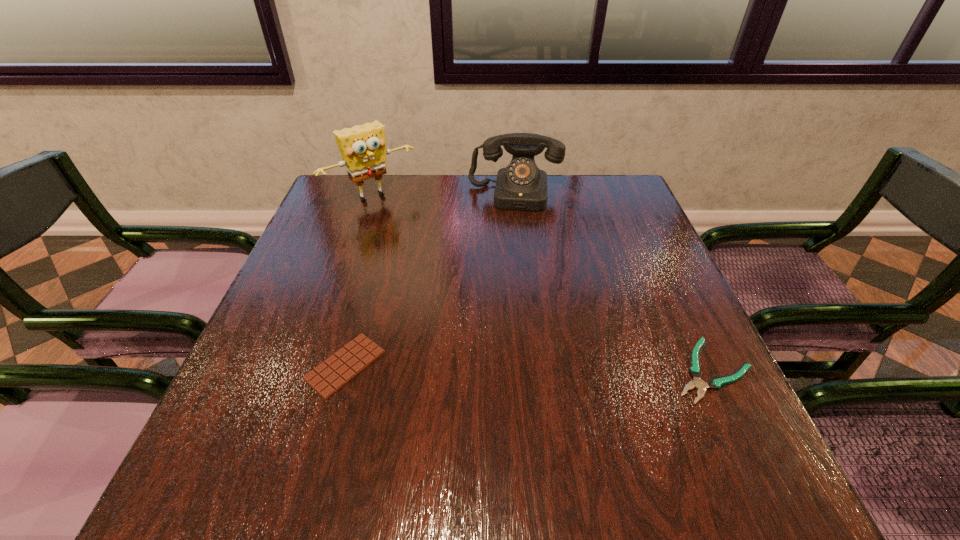
Where is `free space between the pliers and the telephone`? Image resolution: width=960 pixels, height=540 pixels. free space between the pliers and the telephone is located at coordinates (612, 282).

At what (x,y) coordinates should I click in order to perform the action: click on vacant area between the rightmost object and the telephone. Please return your answer as a coordinate pair (x, y). The image size is (960, 540). Looking at the image, I should click on (612, 282).

At what (x,y) coordinates should I click in order to perform the action: click on vacant area that lies between the candy bar and the sponge. Please return your answer as a coordinate pair (x, y). This screenshot has width=960, height=540. Looking at the image, I should click on (359, 281).

Where is `empty space that is in between the candy bar and the tallest object`? The height and width of the screenshot is (540, 960). empty space that is in between the candy bar and the tallest object is located at coordinates (359, 281).

This screenshot has height=540, width=960. I want to click on free space between the rightmost object and the sponge, so click(x=541, y=284).

Identify the location of unoccupied position between the sponge and the third shortest object. The image size is (960, 540). (444, 195).

Find the location of `free space between the second tallest object and the candy bar`. free space between the second tallest object and the candy bar is located at coordinates (430, 280).

At what (x,y) coordinates should I click in order to perform the action: click on unoccupied area between the pliers and the second object from right to left. Please return your answer as a coordinate pair (x, y). Looking at the image, I should click on (612, 282).

You are a GUI agent. You are given a task and a screenshot of the screen. Output one action in this format:
    pyautogui.click(x=<x>, y=<y>)
    Task: Click on the object that can be found as the second closest to the pliers
    
    Given the screenshot: What is the action you would take?
    pyautogui.click(x=334, y=373)

I want to click on object that stands as the second closest to the pliers, so click(334, 373).